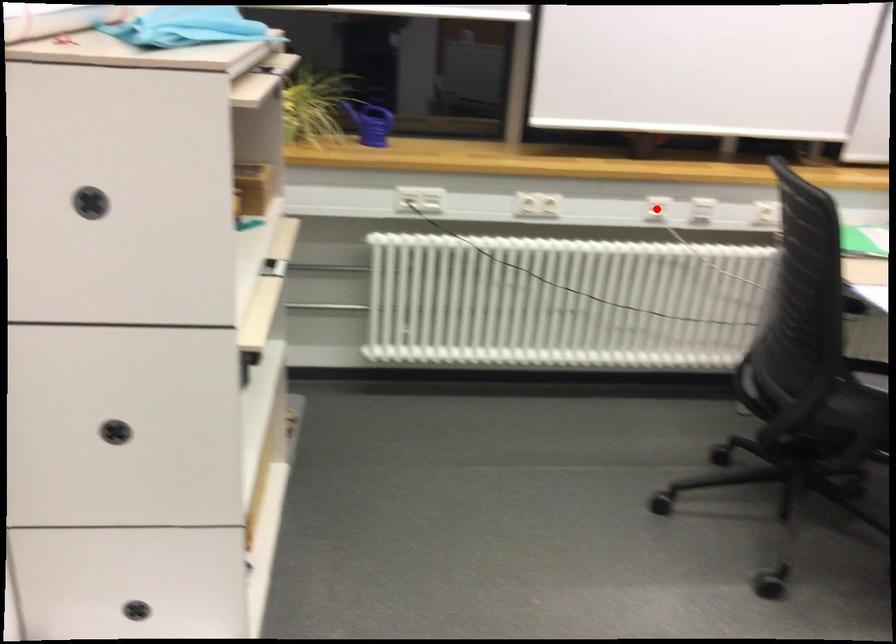
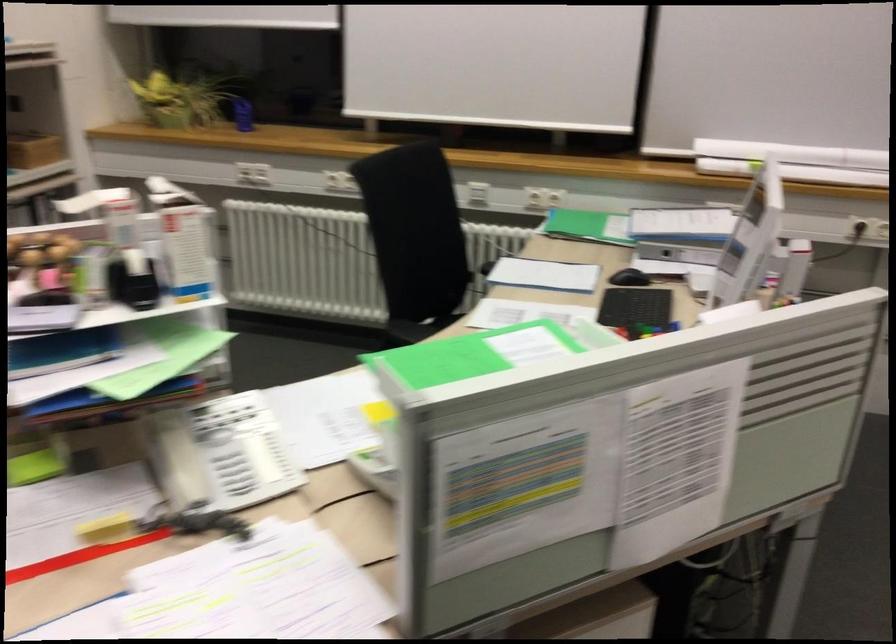
Question: I am providing you with two images of the same scene from different viewpoints. A red point is marked on the first image. At the location where the point appears in image 1, is it still visible in image 2?

Choices:
 (A) Yes
 (B) No

Answer: (B)